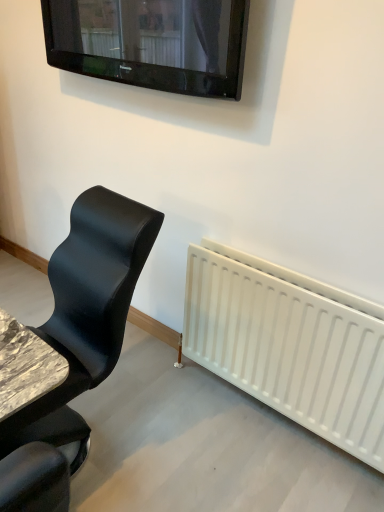
Question: Is black leather chair at left looking in the opposite direction of black glossy tv at upper center?

Choices:
 (A) no
 (B) yes

Answer: (A)

Question: Is black leather chair at left thinner than black glossy tv at upper center?

Choices:
 (A) no
 (B) yes

Answer: (A)

Question: From the image's perspective, would you say black leather chair at left is shown under black glossy tv at upper center?

Choices:
 (A) yes
 (B) no

Answer: (A)

Question: Does black leather chair at left lie in front of black glossy tv at upper center?

Choices:
 (A) no
 (B) yes

Answer: (B)

Question: Can you confirm if black leather chair at left is positioned to the left of black glossy tv at upper center?

Choices:
 (A) yes
 (B) no

Answer: (A)

Question: Is black leather chair at left facing towards black glossy tv at upper center?

Choices:
 (A) no
 (B) yes

Answer: (A)

Question: Can you confirm if black glossy tv at upper center is smaller than black leather chair at left?

Choices:
 (A) yes
 (B) no

Answer: (A)

Question: Does black glossy tv at upper center have a greater width compared to black leather chair at left?

Choices:
 (A) yes
 (B) no

Answer: (B)

Question: From the image's perspective, is black glossy tv at upper center under black leather chair at left?

Choices:
 (A) no
 (B) yes

Answer: (A)

Question: Is black glossy tv at upper center located outside black leather chair at left?

Choices:
 (A) no
 (B) yes

Answer: (B)

Question: Is black glossy tv at upper center at the left side of black leather chair at left?

Choices:
 (A) yes
 (B) no

Answer: (B)

Question: From a real-world perspective, is black glossy tv at upper center located higher than black leather chair at left?

Choices:
 (A) yes
 (B) no

Answer: (A)

Question: Is black glossy tv at upper center in front of or behind black leather chair at left in the image?

Choices:
 (A) front
 (B) behind

Answer: (B)